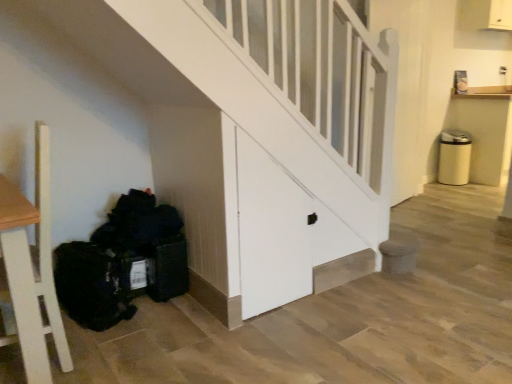
Question: Considering the relative positions of black fabric bag at lower left and white wood door at center in the image provided, is black fabric bag at lower left to the left or to the right of white wood door at center?

Choices:
 (A) left
 (B) right

Answer: (A)

Question: Does point (133, 226) appear closer or farther from the camera than point (290, 261)?

Choices:
 (A) closer
 (B) farther

Answer: (A)

Question: In the image, is black fabric bag at lower left positioned in front of or behind white wood door at center?

Choices:
 (A) front
 (B) behind

Answer: (B)

Question: Is white wood door at center wider or thinner than black fabric bag at lower left?

Choices:
 (A) wide
 (B) thin

Answer: (B)

Question: From a real-world perspective, is white wood door at center above or below black fabric bag at lower left?

Choices:
 (A) above
 (B) below

Answer: (A)

Question: From the image's perspective, relative to black fabric bag at lower left, is white wood door at center above or below?

Choices:
 (A) below
 (B) above

Answer: (B)

Question: Based on their positions, is white wood door at center located to the left or right of black fabric bag at lower left?

Choices:
 (A) right
 (B) left

Answer: (A)